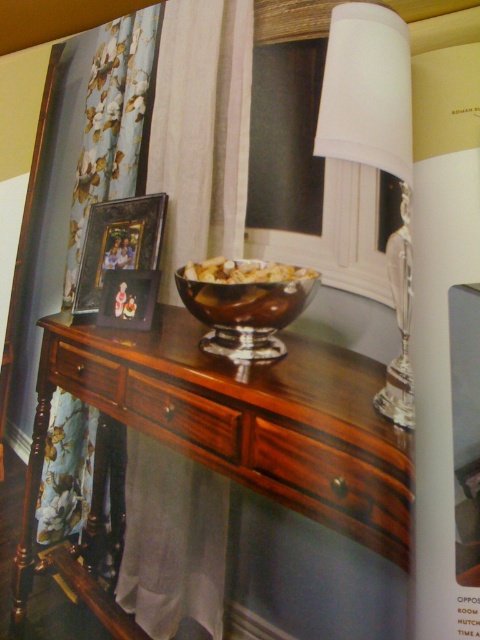
You are organizing a party in this living room and need to place a large centerpiece on the table. Given the current items on the mahogany wood dresser at center and the floral fabric curtain at left, which object should you consider moving to make space?

The mahogany wood dresser at center is larger in size than the floral fabric curtain at left, so you should consider moving the mahogany wood dresser at center to make more space for the centerpiece.

You are standing in the living room and want to place a small vase on the mahogany drawer at center. Based on the coordinates provided, can you determine if the drawer is positioned towards the left or right side of the room?

The mahogany drawer at center is positioned at coordinates point (330, 484). Since the x coordinate is 0.758, which is closer to 1 than 0, the drawer is positioned towards the right side of the room.